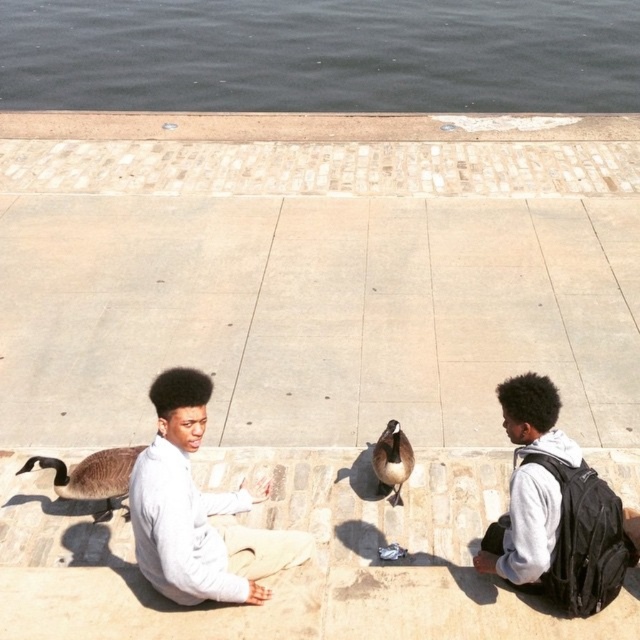
Does dark gray water at upper center appear on the left side of brown feathered duck at center?

Correct, you'll find dark gray water at upper center to the left of brown feathered duck at center.

Which is behind, point (397, 77) or point (397, 438)?

The point (397, 77) is behind.

Is point (305, 45) farther from camera compared to point (372, 449)?

Yes, it is.

Where is `dark gray water at upper center`? dark gray water at upper center is located at coordinates (321, 54).

Who is more distant from viewer, (x=99, y=486) or (x=378, y=474)?

Positioned behind is point (x=378, y=474).

Between brown matte duck at lower left and brown feathered duck at center, which one appears on the left side from the viewer's perspective?

Positioned to the left is brown matte duck at lower left.

Locate an element on the screen. The image size is (640, 640). brown matte duck at lower left is located at coordinates (92, 476).

Does dark gray water at upper center appear on the left side of gray fleece hoodie at right?

Correct, you'll find dark gray water at upper center to the left of gray fleece hoodie at right.

In the scene shown: Is dark gray water at upper center further to the viewer compared to gray fleece hoodie at right?

Yes, dark gray water at upper center is further from the viewer.

Image resolution: width=640 pixels, height=640 pixels. Identify the location of dark gray water at upper center. (321, 54).